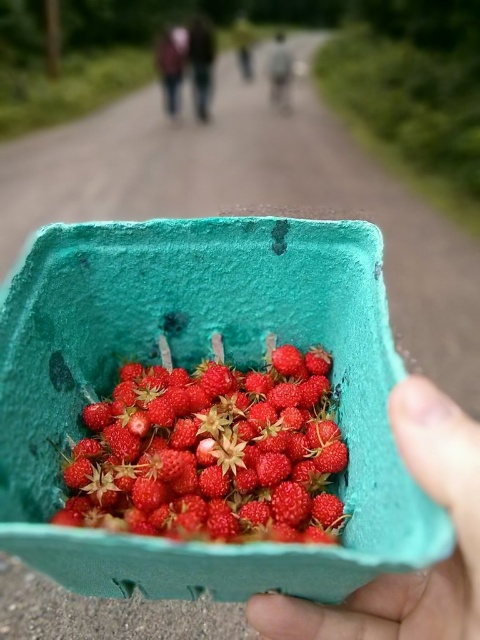
You are a delivery person who needs to place the green foam basket at center into a storage bin that is 15 inches deep. Will the basket fit entirely inside the bin?

The green foam basket at center is 14.61 inches away from the viewer, so it will fit entirely inside the storage bin that is 15 inches deep since it is slightly shorter than the bin.

Consider the image. You are a photographer trying to focus on two points in the image. The first point is point (248, 88) and the second is point (203, 93). Which point is closer to you?

Point (248, 88) is closer to you than point (203, 93).

You are organizing items in a storage room and need to place the green foam basket at center and the dark brown leather jacket at upper center. Based on their positions in the image, which item should you place closer to the entrance so that it is more visible to visitors?

The green foam basket at center should be placed closer to the entrance because it is in front of the dark brown leather jacket at upper center, meaning it is already positioned closer to the viewer and would remain more visible if kept that way.